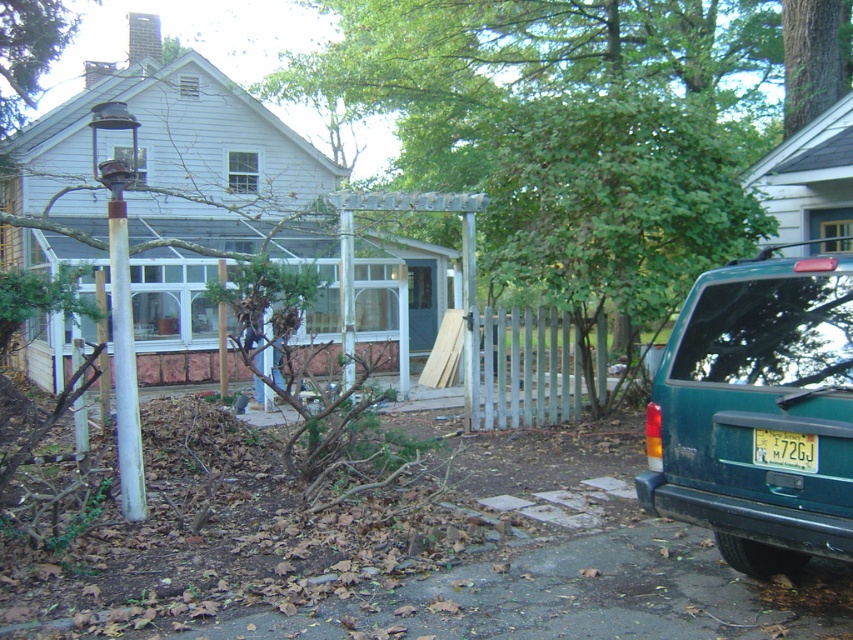
Question: Which object appears farthest from the camera in this image?

Choices:
 (A) yellow matte license plate at lower right
 (B) green leafy tree at center
 (C) teal matte suv at lower right

Answer: (B)

Question: Can you confirm if green leafy tree at center is wider than yellow matte license plate at lower right?

Choices:
 (A) no
 (B) yes

Answer: (B)

Question: Which of these objects is positioned farthest from the teal matte suv at lower right?

Choices:
 (A) yellow matte license plate at lower right
 (B) green leafy tree at center

Answer: (B)

Question: Does green leafy tree at center have a smaller size compared to yellow matte license plate at lower right?

Choices:
 (A) no
 (B) yes

Answer: (A)

Question: Does teal matte suv at lower right lie in front of yellow matte license plate at lower right?

Choices:
 (A) yes
 (B) no

Answer: (A)

Question: Among these points, which one is farthest from the camera?

Choices:
 (A) (799, 275)
 (B) (469, 122)

Answer: (B)